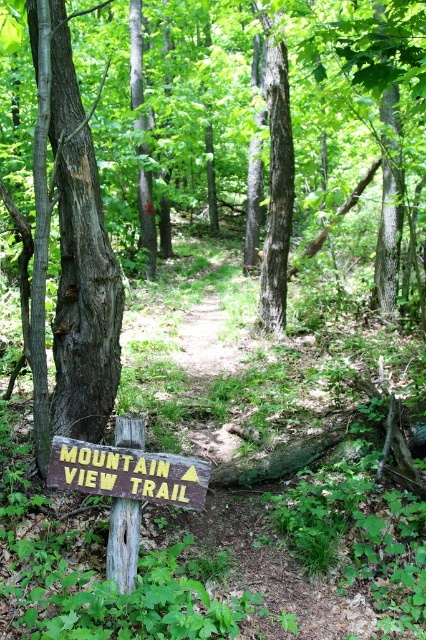
You are a hiker who wants to read the trail signs clearly. You notice two signs ahead on the path. Which one is larger between the brown wooden sign at lower center and the weathered brown signpost at lower left?

The brown wooden sign at lower center is bigger than the weathered brown signpost at lower left, so it is the larger one.

You are hiking along the trail and see both the brown wooden sign at lower center and the weathered brown signpost at lower left. Which one is positioned higher up the trail?

The brown wooden sign at lower center is positioned higher up the trail because it is located above the weathered brown signpost at lower left.